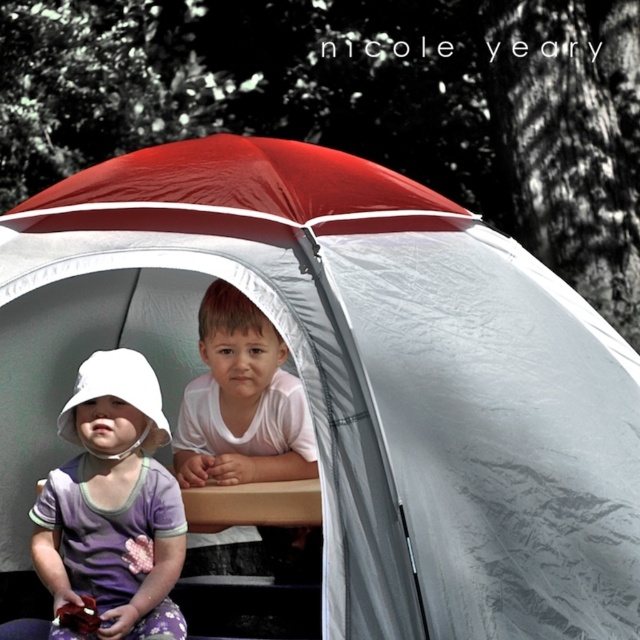
Question: Does purple cotton dress at lower left appear over white matte shirt at center?

Choices:
 (A) yes
 (B) no

Answer: (B)

Question: Is purple cotton dress at lower left thinner than white matte shirt at center?

Choices:
 (A) no
 (B) yes

Answer: (B)

Question: Does purple cotton dress at lower left appear on the left side of white matte shirt at center?

Choices:
 (A) no
 (B) yes

Answer: (B)

Question: Which of the following is the closest to the observer?

Choices:
 (A) white matte shirt at center
 (B) purple cotton dress at lower left

Answer: (B)

Question: Which point appears farthest from the camera in this image?

Choices:
 (A) (225, 388)
 (B) (145, 428)

Answer: (A)